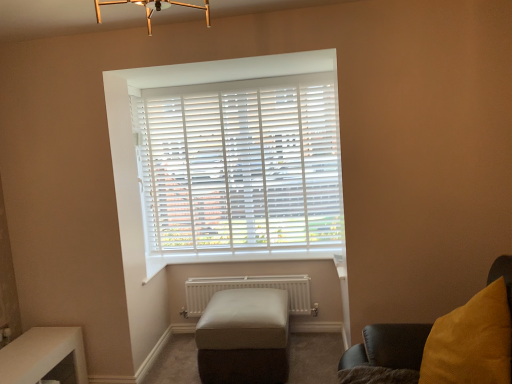
Locate an element on the screen. Image resolution: width=512 pixels, height=384 pixels. velvet yellow cushion at right is located at coordinates (385, 355).

What is the approximate width of white matte radiator at lower center?

The width of white matte radiator at lower center is 4.77 inches.

Find the location of a particular element. The image size is (512, 384). leather ottoman at center is located at coordinates (244, 337).

Identify the location of velvet yellow cushion at right. [x=385, y=355].

Which object is closer to the camera taking this photo, leather ottoman at center or white matte radiator at lower center?

Positioned in front is leather ottoman at center.

In terms of height, does leather ottoman at center look taller or shorter compared to white matte radiator at lower center?

In the image, leather ottoman at center appears to be taller than white matte radiator at lower center.

From the image's perspective, between leather ottoman at center and white matte radiator at lower center, who is located below?

From the image's view, leather ottoman at center is below.

Considering the sizes of objects leather ottoman at center and white matte radiator at lower center in the image provided, who is thinner, leather ottoman at center or white matte radiator at lower center?

Thinner between the two is white matte radiator at lower center.

From the picture: Can you see white glossy table at lower left touching leather ottoman at center?

No, white glossy table at lower left is not beside leather ottoman at center.

Is the depth of white glossy table at lower left greater than that of leather ottoman at center?

That is False.

In the scene shown: Is white glossy table at lower left smaller than leather ottoman at center?

Correct, white glossy table at lower left occupies less space than leather ottoman at center.

From a real-world perspective, is white glossy table at lower left located beneath leather ottoman at center?

Indeed, from a real-world perspective, white glossy table at lower left is positioned beneath leather ottoman at center.

From the image's perspective, which is below, white glossy table at lower left or velvet yellow cushion at right?

white glossy table at lower left is shown below in the image.

Is white glossy table at lower left wider than velvet yellow cushion at right?

No, white glossy table at lower left is not wider than velvet yellow cushion at right.

Is velvet yellow cushion at right at the back of white glossy table at lower left?

No, velvet yellow cushion at right is not at the back of white glossy table at lower left.

Is white glossy table at lower left in front of or behind white plastic blinds at center in the image?

white glossy table at lower left is in front of white plastic blinds at center.

Between white glossy table at lower left and white plastic blinds at center, which one appears on the right side from the viewer's perspective?

From the viewer's perspective, white plastic blinds at center appears more on the right side.

From a real-world perspective, relative to white plastic blinds at center, is white glossy table at lower left vertically above or below?

From a real-world perspective, white glossy table at lower left is physically below white plastic blinds at center.

Can you tell me how much white glossy table at lower left and white plastic blinds at center differ in facing direction?

The angular difference between white glossy table at lower left and white plastic blinds at center is 90 degrees.

Does point (240, 378) lie in front of point (36, 343)?

That is False.

Is leather ottoman at center in front of white glossy table at lower left?

That is False.

Is leather ottoman at center oriented away from white glossy table at lower left?

That's not correct — leather ottoman at center is not looking away from white glossy table at lower left.

Is leather ottoman at center located outside white glossy table at lower left?

leather ottoman at center lies outside white glossy table at lower left's area.

Looking at this image, does white matte radiator at lower center have a greater height compared to leather ottoman at center?

Incorrect, the height of white matte radiator at lower center is not larger of that of leather ottoman at center.

Is white matte radiator at lower center positioned beyond the bounds of leather ottoman at center?

Yes, white matte radiator at lower center is outside of leather ottoman at center.

Is white matte radiator at lower center directly adjacent to leather ottoman at center?

No, white matte radiator at lower center is not with leather ottoman at center.

From a real-world perspective, who is located higher, white matte radiator at lower center or leather ottoman at center?

In real-world perspective, white matte radiator at lower center is above.

Which point is more distant from viewer, (186,309) or (404,325)?

Point (186,309)

Considering the sizes of objects white matte radiator at lower center and velvet yellow cushion at right in the image provided, who is taller, white matte radiator at lower center or velvet yellow cushion at right?

Standing taller between the two is velvet yellow cushion at right.

Is white matte radiator at lower center to the left of velvet yellow cushion at right from the viewer's perspective?

Yes, white matte radiator at lower center is to the left of velvet yellow cushion at right.

Locate an element on the screen. The image size is (512, 384). radiator below the velvet yellow cushion at right (from the image's perspective) is located at coordinates (248, 287).

Find the location of a particular element. Image resolution: width=512 pixels, height=384 pixels. stool below the white matte radiator at lower center (from the image's perspective) is located at coordinates (244, 337).

Locate an element on the screen. The height and width of the screenshot is (384, 512). stool that is on the right side of white glossy table at lower left is located at coordinates point(244,337).

When comparing their distances from white glossy table at lower left, does velvet yellow cushion at right or white plastic blinds at center seem closer?

Among the two, white plastic blinds at center is located nearer to white glossy table at lower left.

Considering their positions, is velvet yellow cushion at right positioned further to white matte radiator at lower center than leather ottoman at center?

velvet yellow cushion at right is positioned further to the anchor white matte radiator at lower center.

Considering their positions, is white glossy table at lower left positioned closer to white plastic blinds at center than velvet yellow cushion at right?

white glossy table at lower left is positioned closer to the anchor white plastic blinds at center.

Considering their positions, is white plastic blinds at center positioned closer to white glossy table at lower left than white matte radiator at lower center?

white matte radiator at lower center is positioned closer to the anchor white glossy table at lower left.

Which object lies further to the anchor point white matte radiator at lower center, leather ottoman at center or white plastic blinds at center?

white plastic blinds at center is positioned further to the anchor white matte radiator at lower center.

Based on their spatial positions, is white glossy table at lower left or velvet yellow cushion at right further from leather ottoman at center?

The object further to leather ottoman at center is white glossy table at lower left.

When comparing their distances from white matte radiator at lower center, does white glossy table at lower left or white plastic blinds at center seem further?

white glossy table at lower left is further to white matte radiator at lower center.

From the image, which object appears to be farther from white glossy table at lower left, white matte radiator at lower center or white plastic blinds at center?

white plastic blinds at center is positioned further to the anchor white glossy table at lower left.

I want to click on stool between white plastic blinds at center and white glossy table at lower left in the vertical direction, so click(x=244, y=337).

Image resolution: width=512 pixels, height=384 pixels. Find the location of `radiator between white plastic blinds at center and leather ottoman at center from top to bottom`. radiator between white plastic blinds at center and leather ottoman at center from top to bottom is located at coordinates (248, 287).

You are a GUI agent. You are given a task and a screenshot of the screen. Output one action in this format:
    pyautogui.click(x=<x>, y=<y>)
    Task: Click on the radiator between velvet yellow cushion at right and white plastic blinds at center from front to back
    The width and height of the screenshot is (512, 384).
    Given the screenshot: What is the action you would take?
    pyautogui.click(x=248, y=287)

Where is `stool between white glossy table at lower left and white matte radiator at lower center`? The height and width of the screenshot is (384, 512). stool between white glossy table at lower left and white matte radiator at lower center is located at coordinates (244, 337).